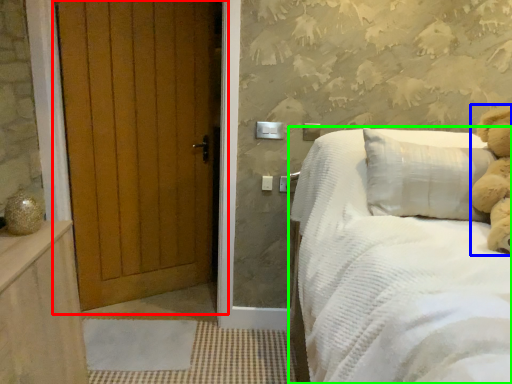
Question: Considering the real-world distances, which object is closest to door (highlighted by a red box)? teddy (highlighted by a blue box) or bed (highlighted by a green box).

Choices:
 (A) teddy
 (B) bed

Answer: (B)